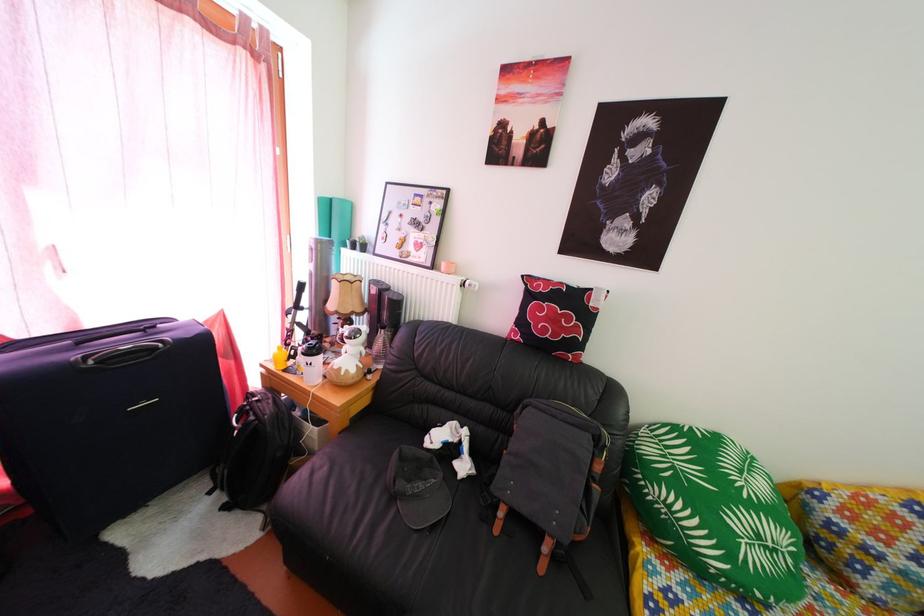
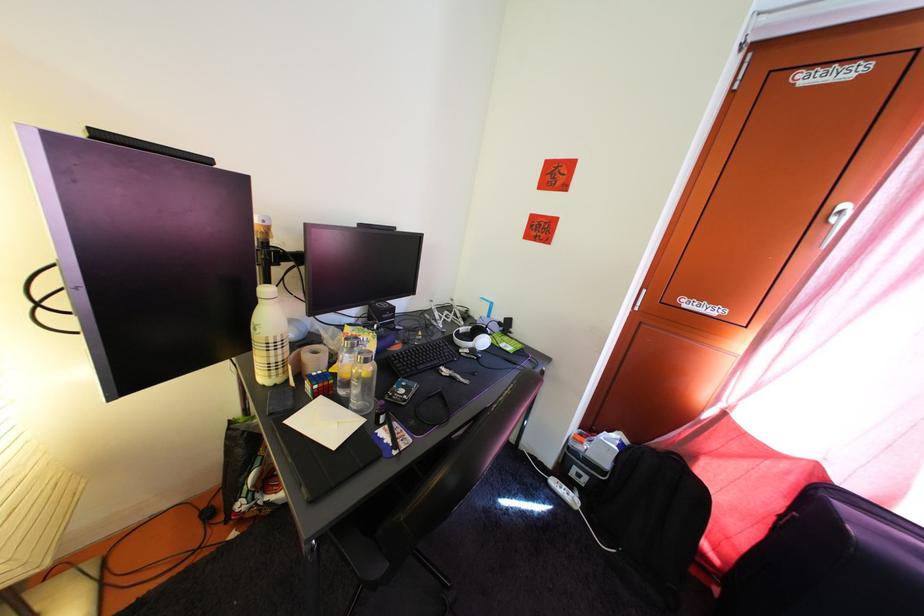
Question: The images are taken continuously from a first-person perspective. In which direction is your viewpoint rotating?

Choices:
 (A) Left
 (B) Right
 (C) Up
 (D) Down

Answer: (A)